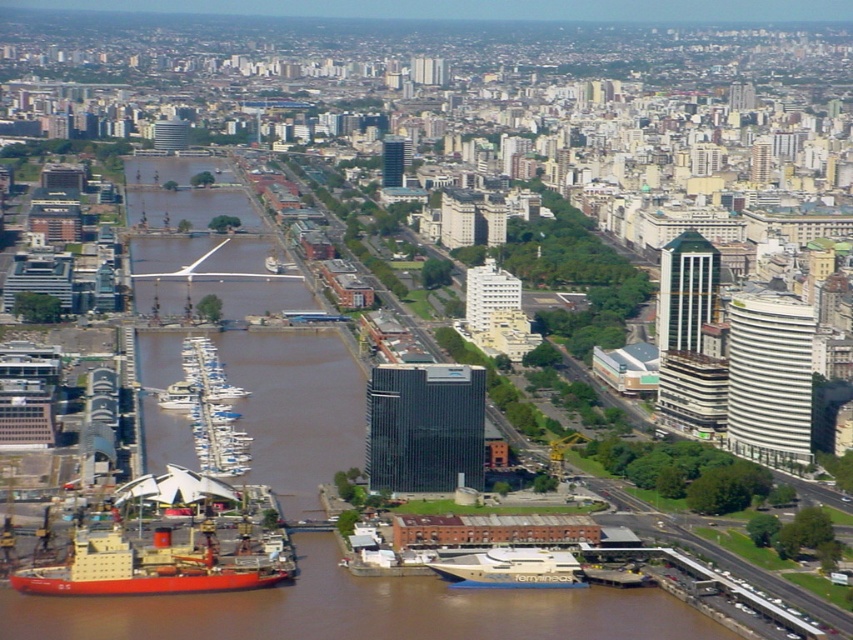
Which is above, red matte ship at lower left or gold polished yacht at lower center?

red matte ship at lower left

Which is in front, point (90, 589) or point (572, 577)?

Positioned in front is point (572, 577).

Where is `red matte ship at lower left`? This screenshot has width=853, height=640. red matte ship at lower left is located at coordinates (155, 566).

From the picture: Can you confirm if white glossy boats at center-left is positioned below gold polished yacht at lower center?

No.

The image size is (853, 640). Find the location of `white glossy boats at center-left`. white glossy boats at center-left is located at coordinates (209, 410).

Which is behind, point (244, 573) or point (206, 397)?

The point (244, 573) is behind.

Can you confirm if red matte ship at lower left is wider than white glossy boats at center-left?

Correct, the width of red matte ship at lower left exceeds that of white glossy boats at center-left.

Is point (135, 570) in front of point (218, 358)?

No, it is behind (218, 358).

Where is `red matte ship at lower left`? This screenshot has height=640, width=853. red matte ship at lower left is located at coordinates (155, 566).